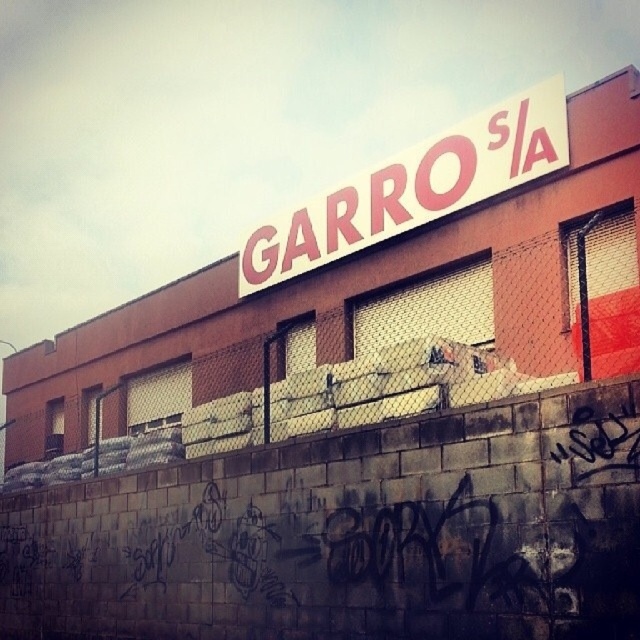
Question: Which of the following is the closest to the observer?

Choices:
 (A) white matte sign at upper center
 (B) metal mesh fence at upper center

Answer: (B)

Question: Can you confirm if metal mesh fence at upper center is smaller than white matte sign at upper center?

Choices:
 (A) no
 (B) yes

Answer: (A)

Question: Observing the image, what is the correct spatial positioning of metal mesh fence at upper center in reference to white matte sign at upper center?

Choices:
 (A) right
 (B) left

Answer: (B)

Question: Can you confirm if metal mesh fence at upper center is positioned below white matte sign at upper center?

Choices:
 (A) no
 (B) yes

Answer: (B)